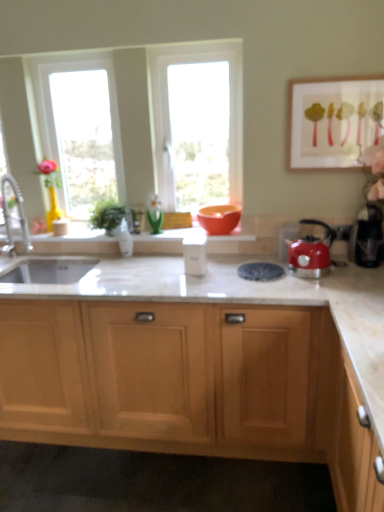
Question: Based on their positions, is green glass vase at center, the first glass vase positioned from the right, located to the left or right of red glossy kettle at right?

Choices:
 (A) right
 (B) left

Answer: (B)

Question: Based on their sizes in the image, would you say green glass vase at center, the first glass vase positioned from the right, is bigger or smaller than red glossy kettle at right?

Choices:
 (A) small
 (B) big

Answer: (A)

Question: Which object is positioned closest to the brushed metal faucet at left?

Choices:
 (A) light wood cabinet at center
 (B) white glossy container at center
 (C) transparent glass window at center, which ranks as the 1th window in right-to-left order
 (D) matte orange bowl at center
 (E) red glossy kettle at right

Answer: (B)

Question: Which is nearer to the red glossy kettle at right?

Choices:
 (A) clear glass window at center, which ranks as the second window in right-to-left order
 (B) green glass vase at center, which appears as the second glass vase when viewed from the left
 (C) clear glass vase at center, the 1th glass vase positioned from the left
 (D) white glossy container at center
 (E) transparent glass window at center, positioned as the 2th window in left-to-right order

Answer: (D)